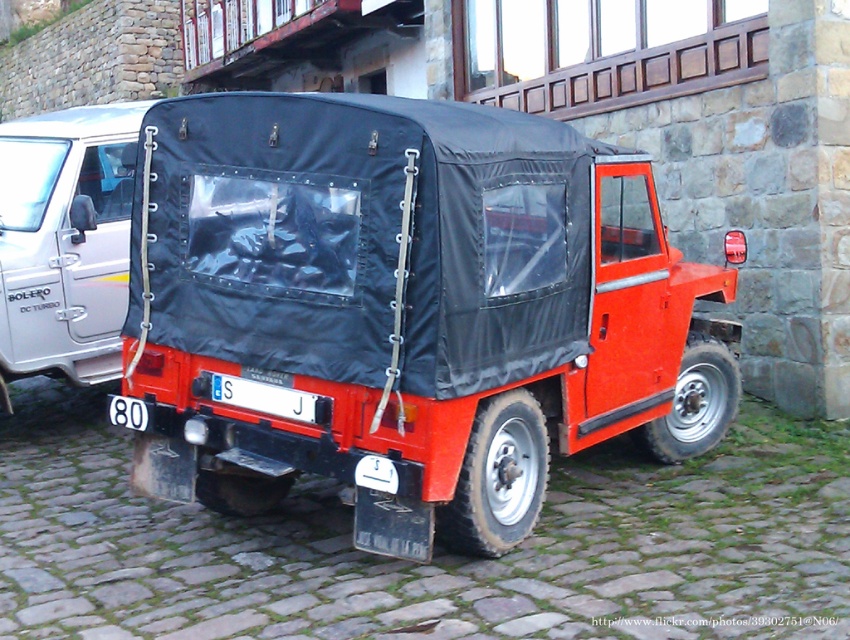
You are a pedestrian standing on the cobblestone street and want to cross to the other side. The matte black truck at center and the matte black car at right are parked. Which vehicle should you walk around to avoid the parked cars?

You should walk around the matte black truck at center because it is located below the matte black car at right, meaning it is closer to the curb and allows a safer path between the two parked vehicles.

You are standing in front of the vintage red vehicle on the cobblestone street. There are two points marked on the vehicle. The first point is at coordinates point (108, 182) and the second is at point (244, 388). If you were to reach out to touch both points, which point would you need to extend your arm further to reach?

You would need to extend your arm further to reach point (244, 388) because it is closer to you than point (108, 182), which is further away from you.